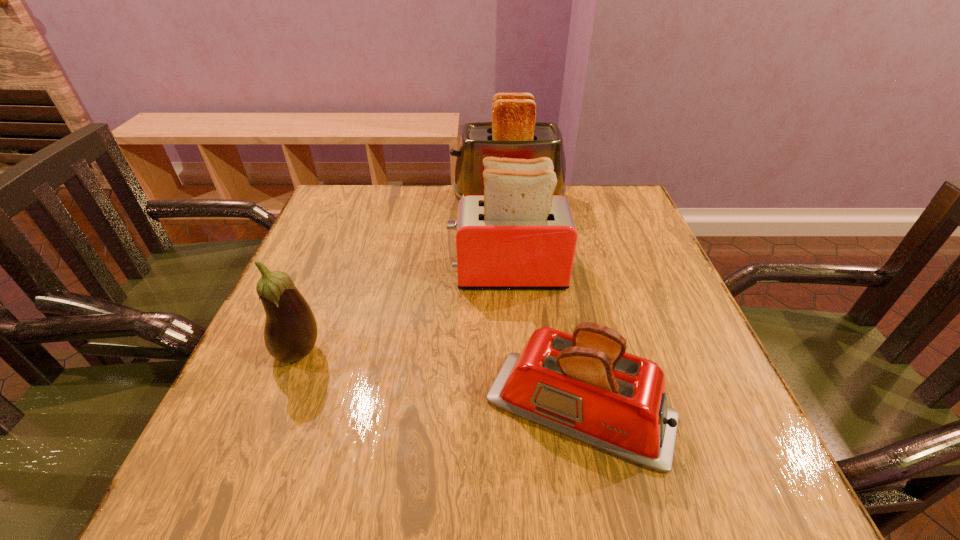
The width and height of the screenshot is (960, 540). Find the location of `vacant space located on the front-facing side of the second farthest object`. vacant space located on the front-facing side of the second farthest object is located at coordinates (423, 272).

Identify the location of vacant space located 0.260m on the front-facing side of the second farthest object. click(336, 272).

Where is `free space located on the right of the third tallest object`? Image resolution: width=960 pixels, height=540 pixels. free space located on the right of the third tallest object is located at coordinates (382, 353).

You are a GUI agent. You are given a task and a screenshot of the screen. Output one action in this format:
    pyautogui.click(x=<x>, y=<y>)
    Task: Click on the vacant region located 0.340m on the back of the shortest toaster
    
    Given the screenshot: What is the action you would take?
    pyautogui.click(x=549, y=247)

The image size is (960, 540). I want to click on object that is positioned at the far edge, so click(x=513, y=133).

Where is `object that is at the near edge`? The image size is (960, 540). object that is at the near edge is located at coordinates tap(586, 386).

Find the location of a particular element. The width and height of the screenshot is (960, 540). object positioned at the left edge is located at coordinates (290, 333).

At what (x,y) coordinates should I click in order to perform the action: click on object present at the right edge. Please return your answer as a coordinate pair (x, y). Image resolution: width=960 pixels, height=540 pixels. Looking at the image, I should click on (586, 386).

I want to click on object that is at the near right corner, so coord(586,386).

You are a GUI agent. You are given a task and a screenshot of the screen. Output one action in this format:
    pyautogui.click(x=<x>, y=<y>)
    Task: Click on the free spot at the near edge of the desktop
    The height and width of the screenshot is (540, 960).
    Given the screenshot: What is the action you would take?
    pyautogui.click(x=424, y=503)